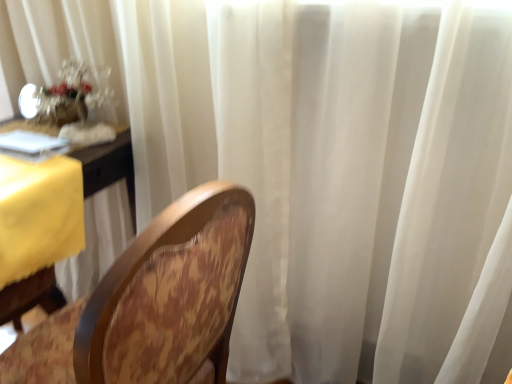
Question: Is translucent glass floral arrangement at upper left located outside yellow fabric table at left?

Choices:
 (A) no
 (B) yes

Answer: (B)

Question: Does translucent glass floral arrangement at upper left appear on the right side of yellow fabric table at left?

Choices:
 (A) yes
 (B) no

Answer: (A)

Question: Is translucent glass floral arrangement at upper left positioned before yellow fabric table at left?

Choices:
 (A) yes
 (B) no

Answer: (B)

Question: From a real-world perspective, is translucent glass floral arrangement at upper left located higher than yellow fabric table at left?

Choices:
 (A) no
 (B) yes

Answer: (B)

Question: Is translucent glass floral arrangement at upper left positioned behind yellow fabric table at left?

Choices:
 (A) no
 (B) yes

Answer: (B)

Question: From a real-world perspective, is wooden chair at center positioned above or below translucent glass floral arrangement at upper left?

Choices:
 (A) below
 (B) above

Answer: (A)

Question: Is wooden chair at center in front of or behind translucent glass floral arrangement at upper left in the image?

Choices:
 (A) front
 (B) behind

Answer: (A)

Question: Is wooden chair at center wider or thinner than translucent glass floral arrangement at upper left?

Choices:
 (A) thin
 (B) wide

Answer: (B)

Question: Is wooden chair at center bigger or smaller than translucent glass floral arrangement at upper left?

Choices:
 (A) big
 (B) small

Answer: (A)

Question: From a real-world perspective, is translucent glass floral arrangement at upper left positioned above or below yellow fabric table at left?

Choices:
 (A) below
 (B) above

Answer: (B)

Question: Is translucent glass floral arrangement at upper left taller or shorter than yellow fabric table at left?

Choices:
 (A) tall
 (B) short

Answer: (B)

Question: Do you think translucent glass floral arrangement at upper left is within yellow fabric table at left, or outside of it?

Choices:
 (A) outside
 (B) inside

Answer: (A)

Question: Based on their sizes in the image, would you say translucent glass floral arrangement at upper left is bigger or smaller than yellow fabric table at left?

Choices:
 (A) big
 (B) small

Answer: (B)

Question: Is yellow fabric table at left bigger or smaller than wooden chair at center?

Choices:
 (A) big
 (B) small

Answer: (B)

Question: Considering their positions, is yellow fabric table at left located in front of or behind wooden chair at center?

Choices:
 (A) behind
 (B) front

Answer: (A)